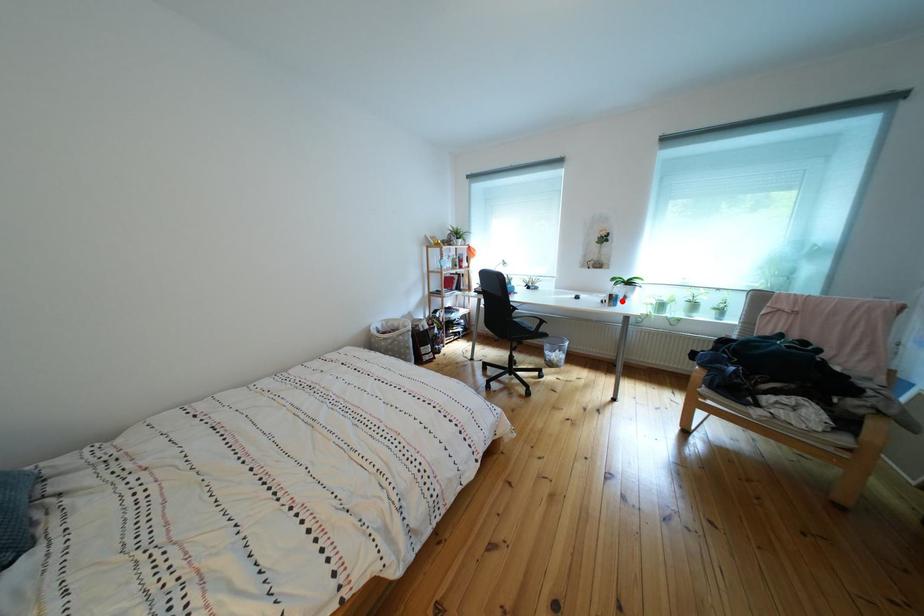
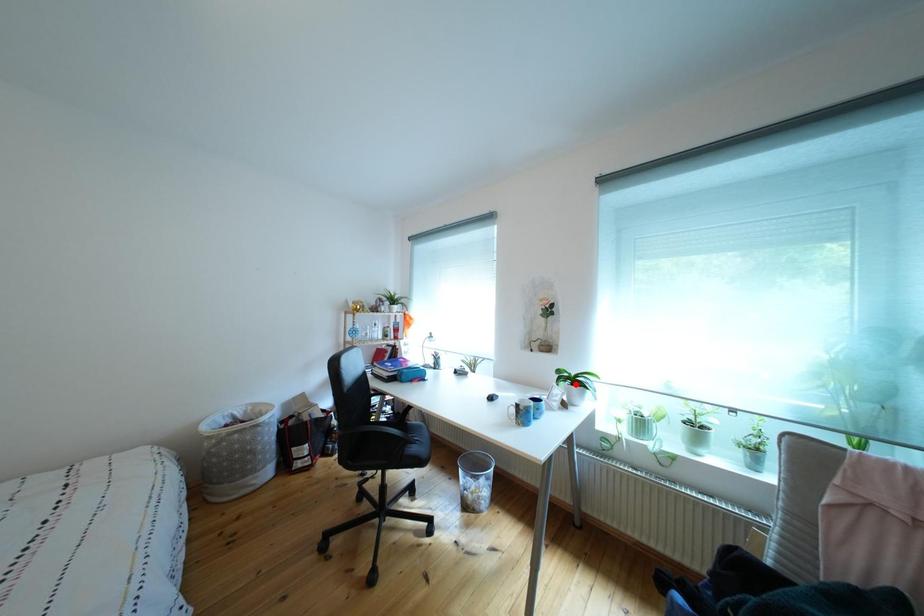
I am providing you with two images of the same scene from different viewpoints. A red point is marked on the first image and another point is marked on the second image. Do the highlighted points in image1 and image2 indicate the same real-world spot?

No